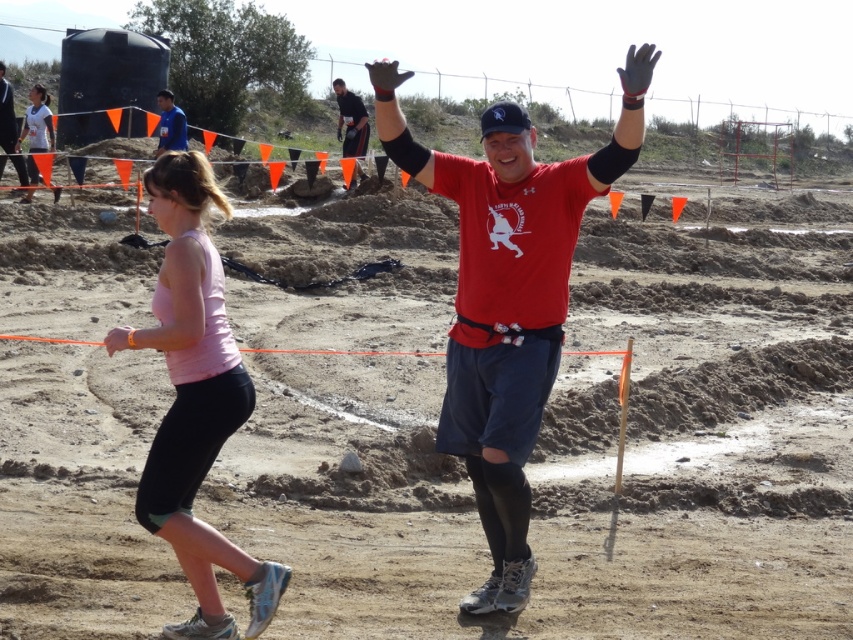
Question: Which point is closer to the camera?

Choices:
 (A) matte black shirt at center
 (B) matte red shirt at center
 (C) matte blue shirt at upper left

Answer: (B)

Question: Which object is positioned farthest from the matte pink tank top at left?

Choices:
 (A) matte black shirt at center
 (B) dirt at center
 (C) matte red shirt at center

Answer: (C)

Question: Can you confirm if matte pink tank top at left is bigger than matte blue shirt at upper left?

Choices:
 (A) yes
 (B) no

Answer: (A)

Question: Does pink fabric tank top at left have a lesser width compared to matte pink tank top at left?

Choices:
 (A) yes
 (B) no

Answer: (A)

Question: Which is farther from the dirt at center?

Choices:
 (A) matte pink tank top at left
 (B) pink fabric tank top at left
 (C) matte black shirt at center

Answer: (A)

Question: Can you confirm if dirt at center is positioned above matte red shirt at center?

Choices:
 (A) no
 (B) yes

Answer: (A)